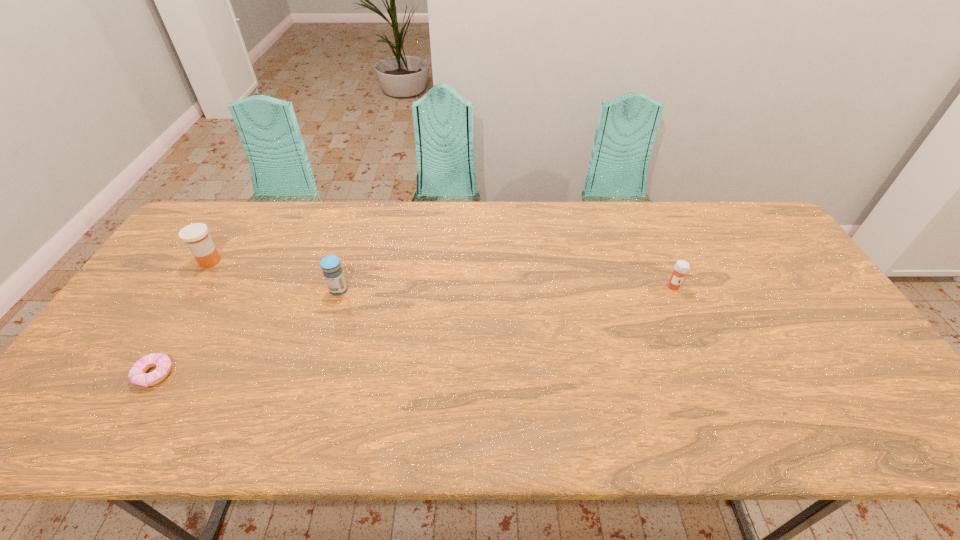
This screenshot has width=960, height=540. What are the coordinates of `vacant space that satisfies the following two spatial constraints: 1. on the label of the nearest object; 2. on the right side of the leftmost medicine` in the screenshot? It's located at (138, 374).

This screenshot has width=960, height=540. Identify the location of vacant space that satisfies the following two spatial constraints: 1. on the label of the second medicine from left to right; 2. on the left side of the farthest medicine. (192, 290).

At what (x,y) coordinates should I click in order to perform the action: click on vacant area that satisfies the following two spatial constraints: 1. on the back side of the shortest object; 2. on the label of the farthest medicine. Please return your answer as a coordinate pair (x, y). The height and width of the screenshot is (540, 960). Looking at the image, I should click on click(223, 261).

Where is `free space that satisfies the following two spatial constraints: 1. on the label of the farthest object; 2. on the right side of the nearest object`? The height and width of the screenshot is (540, 960). free space that satisfies the following two spatial constraints: 1. on the label of the farthest object; 2. on the right side of the nearest object is located at coordinates (138, 374).

Find the location of a particular element. The height and width of the screenshot is (540, 960). vacant space that satisfies the following two spatial constraints: 1. on the label of the second object from right to left; 2. on the left side of the leftmost medicine is located at coordinates (192, 290).

Locate an element on the screen. Image resolution: width=960 pixels, height=540 pixels. vacant area in the image that satisfies the following two spatial constraints: 1. on the back side of the second object from right to left; 2. on the left side of the doughnut is located at coordinates (205, 290).